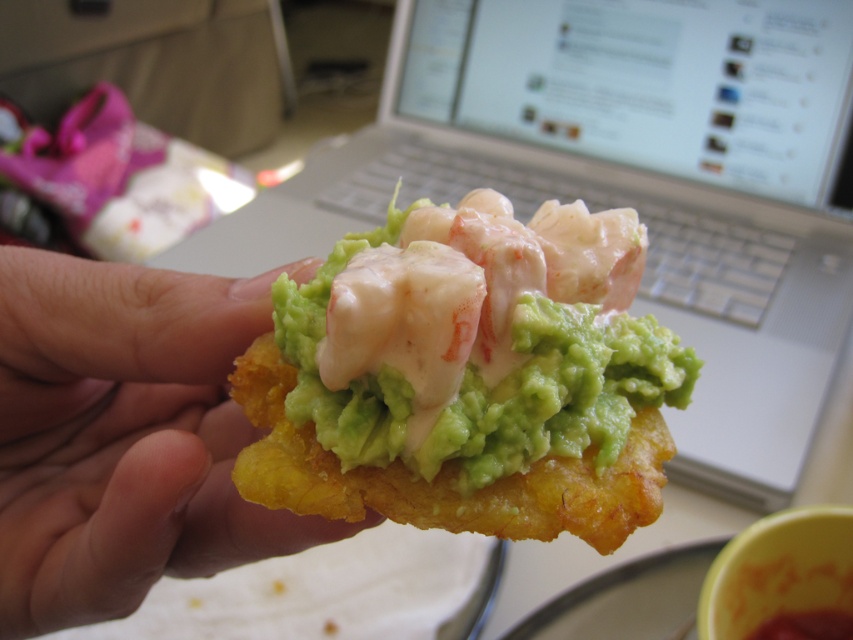
Question: From the image, what is the correct spatial relationship of silver metallic laptop at upper center in relation to golden fried chip at center?

Choices:
 (A) below
 (B) above

Answer: (B)

Question: Based on their relative distances, which object is farther from the green creamy guacamole at center?

Choices:
 (A) silver metallic laptop at upper center
 (B) golden fried chip at center

Answer: (A)

Question: Is green creamy guacamole at center below golden fried chip at center?

Choices:
 (A) yes
 (B) no

Answer: (B)

Question: Which object is the closest to the green creamy guacamole at center?

Choices:
 (A) silver metallic laptop at upper center
 (B) golden fried chip at center

Answer: (B)

Question: Is silver metallic laptop at upper center bigger than green creamy guacamole at center?

Choices:
 (A) yes
 (B) no

Answer: (A)

Question: Which object is closer to the camera taking this photo?

Choices:
 (A) golden fried chip at center
 (B) silver metallic laptop at upper center

Answer: (A)